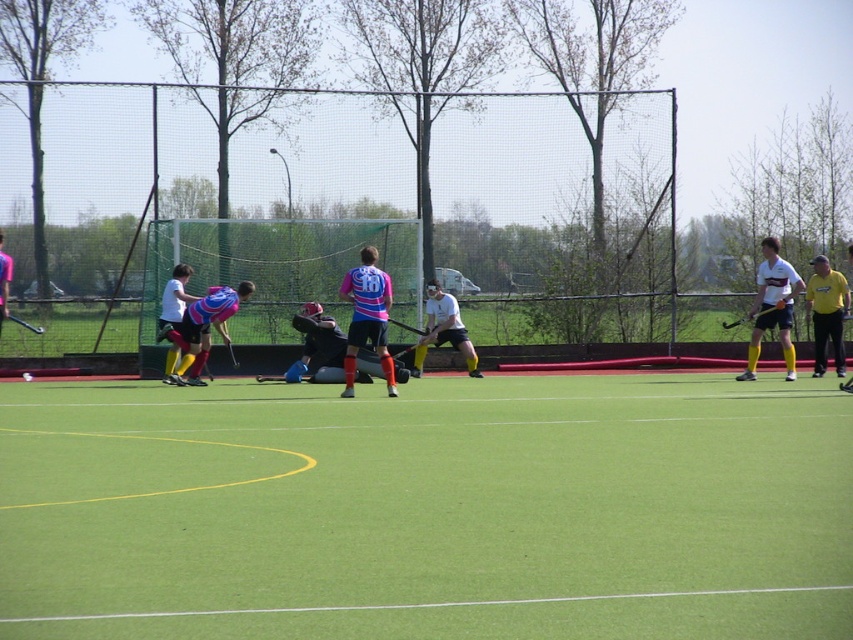
Question: Can you confirm if white matte hockey stick at right is positioned to the right of yellow matte shirt at right?

Choices:
 (A) no
 (B) yes

Answer: (A)

Question: Which is nearer to the white smooth hockey stick at center?

Choices:
 (A) pink matte jersey at center
 (B) yellow matte shirt at right

Answer: (A)

Question: Among these objects, which one is farthest from the camera?

Choices:
 (A) matte pink jersey at center
 (B) green artificial turf at center

Answer: (A)

Question: Does pink matte jersey at center appear on the right side of yellow matte shirt at right?

Choices:
 (A) yes
 (B) no

Answer: (B)

Question: Can you confirm if matte pink jersey at center is bigger than yellow matte shirt at right?

Choices:
 (A) no
 (B) yes

Answer: (B)

Question: Which point is farther to the camera?

Choices:
 (A) (509, 584)
 (B) (434, 284)

Answer: (B)